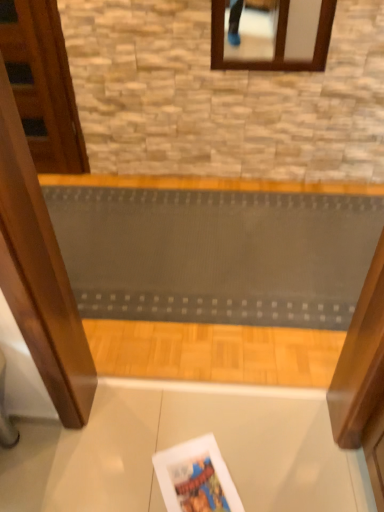
Find the location of a particular element. The width and height of the screenshot is (384, 512). free space underneath matte paper magazine at lower center (from a real-world perspective) is located at coordinates (203, 480).